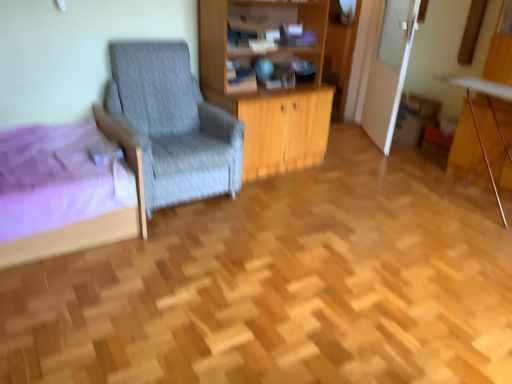
Image resolution: width=512 pixels, height=384 pixels. I want to click on empty space that is to the right of gray fabric chair at left, so click(x=276, y=201).